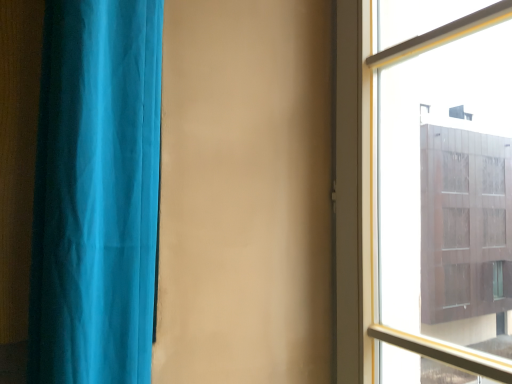
Identify the location of matte blue curtain at left. This screenshot has width=512, height=384. (96, 193).

The height and width of the screenshot is (384, 512). Describe the element at coordinates (96, 193) in the screenshot. I see `matte blue curtain at left` at that location.

Measure the distance between point [142,192] and camera.

Point [142,192] and camera are 53.00 centimeters apart from each other.

What is the approximate height of matte blue curtain at left?

3.31 feet.

The image size is (512, 384). Find the location of `matte blue curtain at left`. matte blue curtain at left is located at coordinates (96, 193).